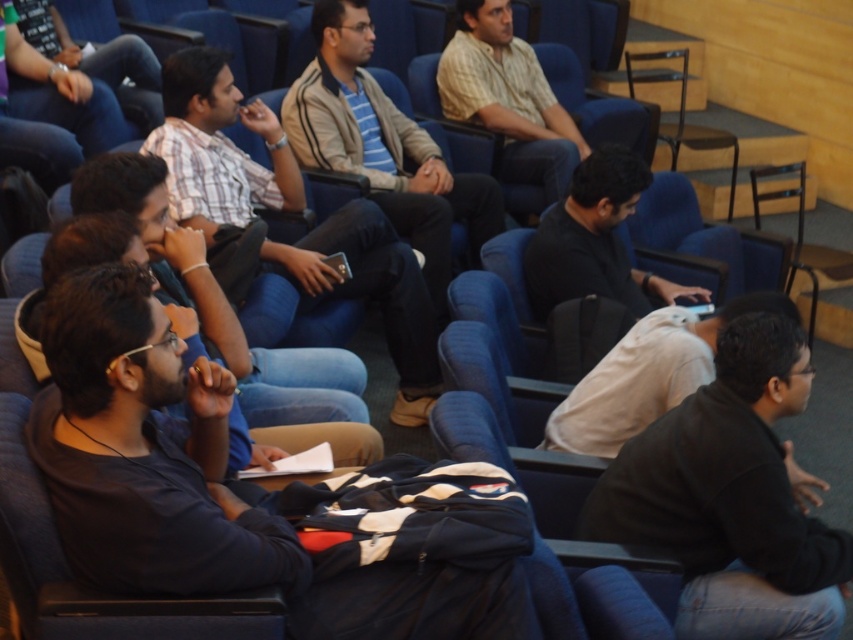
Question: Which is farther from the dark blue shirt at center?

Choices:
 (A) plaid shirt at center
 (B) white matte shirt at center
 (C) black matte jacket at lower right
 (D) dark blue jeans at upper left

Answer: (D)

Question: Which object appears farthest from the camera in this image?

Choices:
 (A) light brown textured shirt at center
 (B) dark blue shirt at center

Answer: (A)

Question: Which point appears closest to the camera in this image?

Choices:
 (A) (543, 218)
 (B) (300, 353)
 (C) (624, 483)

Answer: (C)

Question: Is white matte shirt at center thinner than light brown textured shirt at center?

Choices:
 (A) no
 (B) yes

Answer: (B)

Question: Is black matte jacket at lower right positioned behind striped knit sweater at center?

Choices:
 (A) yes
 (B) no

Answer: (B)

Question: Can you confirm if striped knit sweater at center is positioned to the left of black matte shirt at center?

Choices:
 (A) yes
 (B) no

Answer: (A)